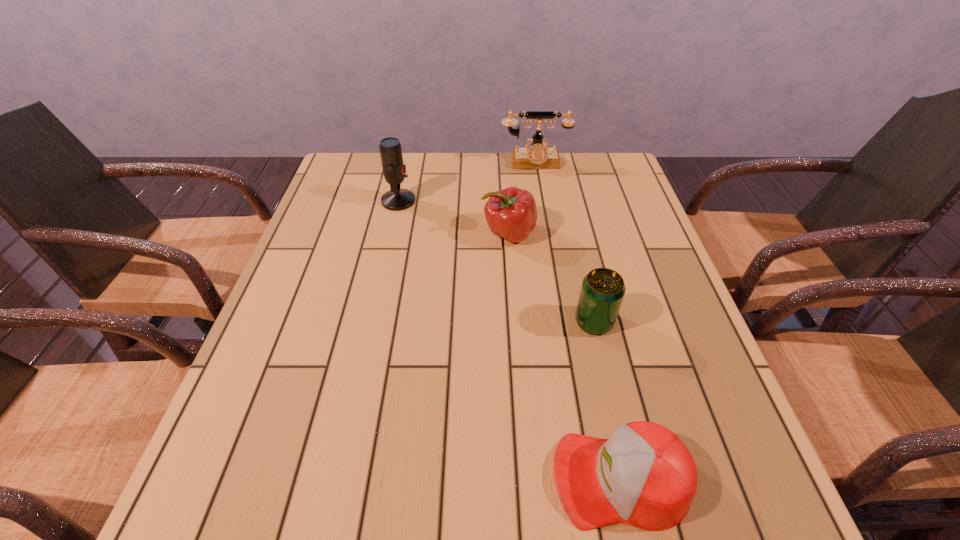
Where is `the leftmost object`? The image size is (960, 540). the leftmost object is located at coordinates (394, 170).

Where is `the fourth nearest object`? The width and height of the screenshot is (960, 540). the fourth nearest object is located at coordinates (394, 170).

This screenshot has height=540, width=960. I want to click on telephone, so pyautogui.click(x=538, y=156).

Where is `the third nearest object`? The height and width of the screenshot is (540, 960). the third nearest object is located at coordinates tap(511, 213).

The width and height of the screenshot is (960, 540). I want to click on beer can, so pos(602,291).

The height and width of the screenshot is (540, 960). What are the coordinates of `baseball cap` in the screenshot? It's located at (643, 475).

The image size is (960, 540). I want to click on the shortest object, so click(x=643, y=475).

Image resolution: width=960 pixels, height=540 pixels. What are the coordinates of `vacant space located on the side of the leftmost object with the red ring` in the screenshot? It's located at (533, 201).

Identify the location of vacant area situated on the dial of the telephone. The height and width of the screenshot is (540, 960). (538, 184).

Identify the location of vacant region located on the right of the third nearest object. (641, 234).